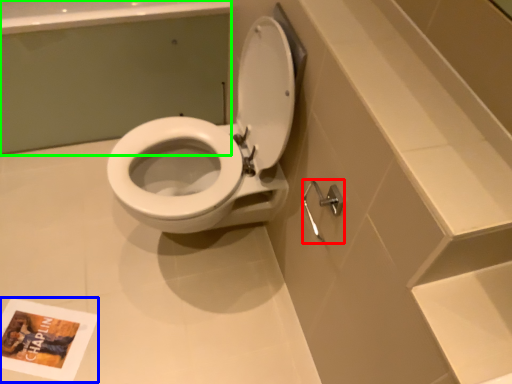
Question: Which object is the farthest from shower (highlighted by a red box)? Choose among these: book cover (highlighted by a blue box) or bath (highlighted by a green box).

Choices:
 (A) book cover
 (B) bath

Answer: (B)